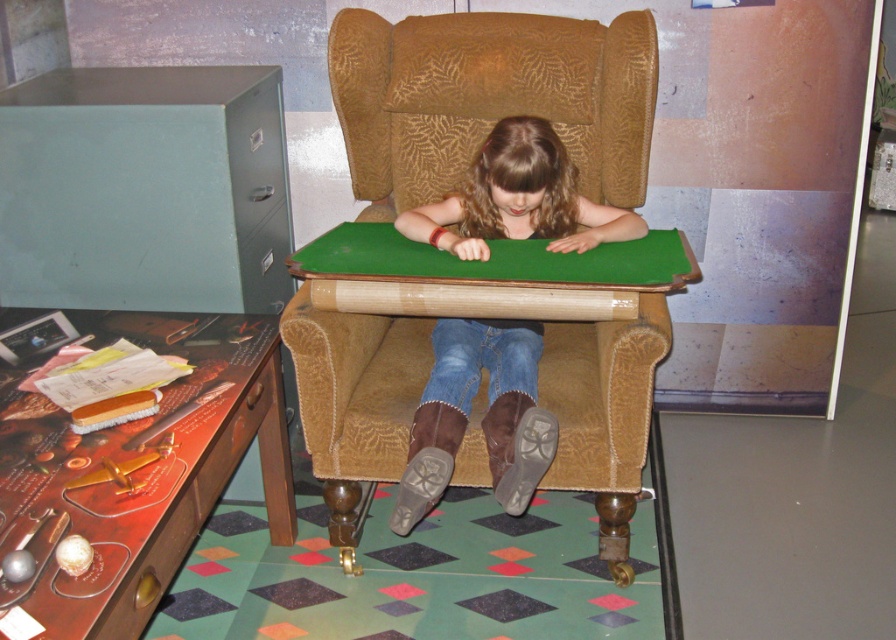
Question: Is wooden desk at lower left further to camera compared to denim jeans at center?

Choices:
 (A) yes
 (B) no

Answer: (B)

Question: Which of the following is the farthest from the observer?

Choices:
 (A) brown textured armchair at center
 (B) denim jeans at center

Answer: (B)

Question: Is brown textured armchair at center to the left of wooden desk at lower left from the viewer's perspective?

Choices:
 (A) yes
 (B) no

Answer: (B)

Question: Which object appears farthest from the camera in this image?

Choices:
 (A) denim jeans at center
 (B) brown textured armchair at center
 (C) wooden desk at lower left

Answer: (A)

Question: Does brown textured armchair at center lie behind denim jeans at center?

Choices:
 (A) yes
 (B) no

Answer: (B)

Question: Which of the following is the closest to the observer?

Choices:
 (A) (475, 246)
 (B) (24, 602)
 (C) (307, 426)

Answer: (B)